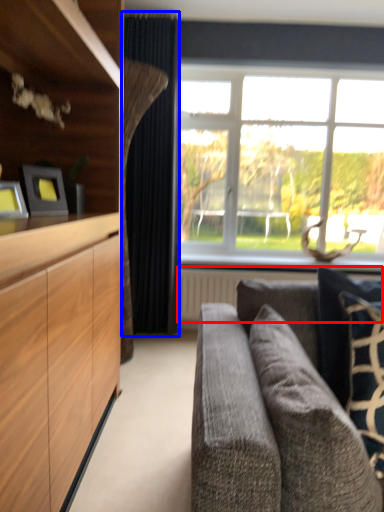
Question: Which object is further to the camera taking this photo, radiator (highlighted by a red box) or curtain (highlighted by a blue box)?

Choices:
 (A) radiator
 (B) curtain

Answer: (A)